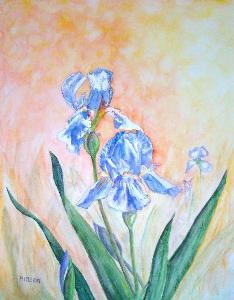
You are a GUI agent. You are given a task and a screenshot of the screen. Output one action in this format:
    pyautogui.click(x=<x>, y=<y>)
    Task: Click on the plant
    The width and height of the screenshot is (234, 300).
    Given the screenshot: What is the action you would take?
    pyautogui.click(x=129, y=286)